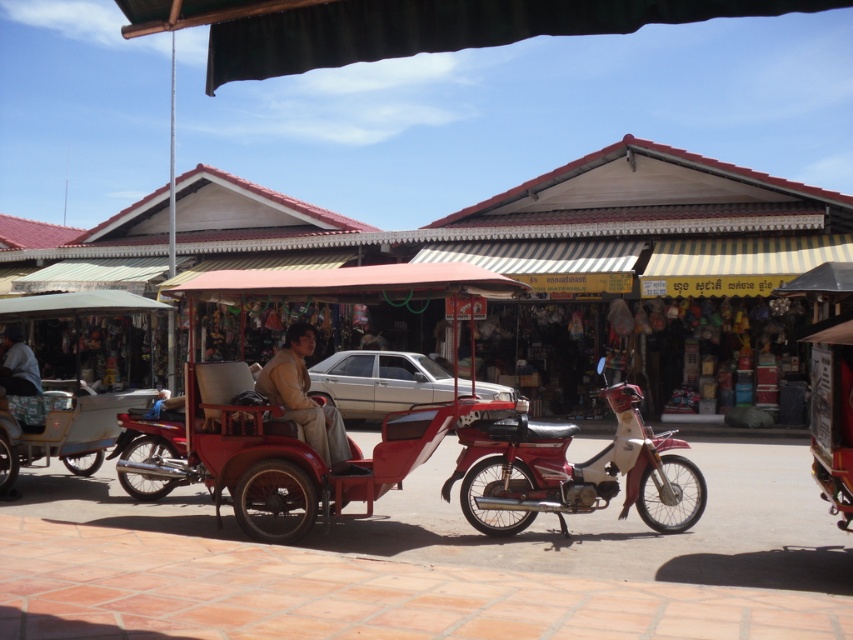
Does point (372, 360) come in front of point (260, 385)?

No, (372, 360) is further to viewer.

Measure the distance between silver metallic car at center and brown leather jacket at center.

silver metallic car at center and brown leather jacket at center are 8.14 meters apart from each other.

Identify the location of silver metallic car at center. point(378,381).

Does point (364, 396) lie in front of point (20, 374)?

No, it is not.

Is silver metallic car at center further to the viewer compared to dark gray fabric jacket at lower left?

That is True.

At what (x,y) coordinates should I click in order to perform the action: click on silver metallic car at center. Please return your answer as a coordinate pair (x, y). This screenshot has width=853, height=640. Looking at the image, I should click on (378, 381).

This screenshot has height=640, width=853. Find the location of `metallic red tricycle at center`. metallic red tricycle at center is located at coordinates (309, 406).

Can you confirm if metallic red tricycle at center is positioned above dark gray fabric jacket at lower left?

Actually, metallic red tricycle at center is below dark gray fabric jacket at lower left.

Who is more forward, (305, 355) or (16, 388)?

Positioned in front is point (305, 355).

I want to click on metallic red tricycle at center, so click(x=309, y=406).